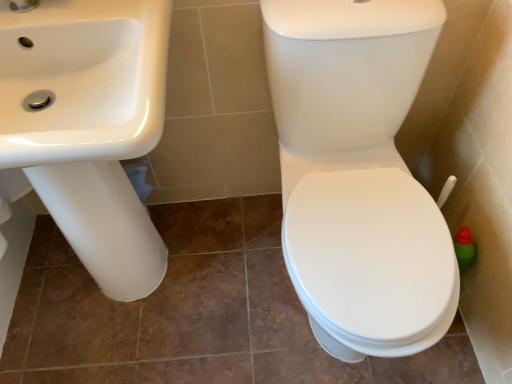
What are the coordinates of `vacant area that lies between white glossy toilet at right and white glossy sink at left` in the screenshot? It's located at (212, 310).